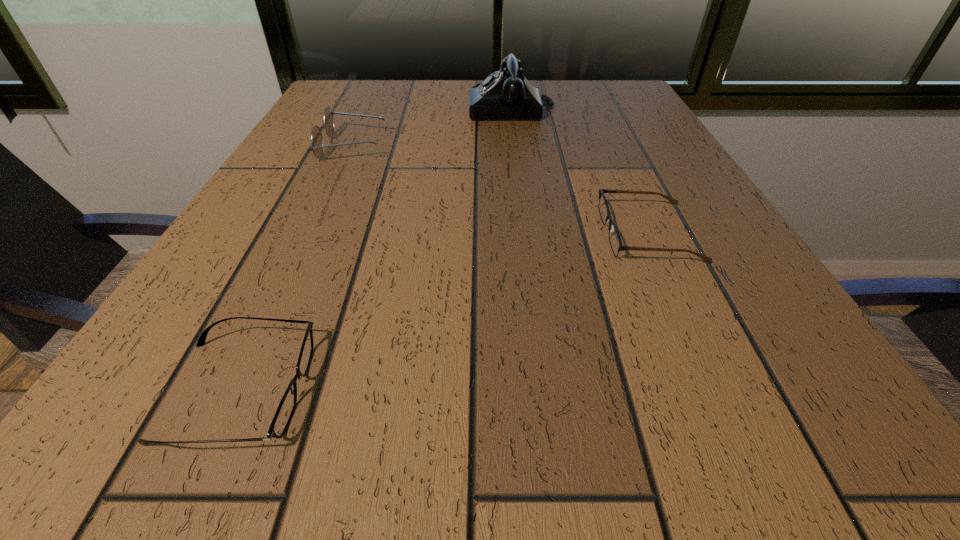
In the image, there is a desktop. In order to click on vacant region at the near edge in this screenshot , I will do [550, 429].

This screenshot has height=540, width=960. Identify the location of free space at the left edge of the desktop. (299, 129).

This screenshot has height=540, width=960. I want to click on vacant space at the right edge of the desktop, so click(654, 126).

Image resolution: width=960 pixels, height=540 pixels. Find the location of `vacant space at the far left corner of the desktop`. vacant space at the far left corner of the desktop is located at coordinates (374, 96).

At what (x,y) coordinates should I click in order to perform the action: click on vacant space at the far right corner. Please return your answer as a coordinate pair (x, y). The height and width of the screenshot is (540, 960). Looking at the image, I should click on (639, 118).

Locate an element on the screen. This screenshot has width=960, height=540. unoccupied area between the nearest spectacles and the farthest spectacles is located at coordinates (296, 268).

This screenshot has height=540, width=960. I want to click on free space that is in between the rightmost object and the second object from right to left, so click(x=580, y=170).

The image size is (960, 540). Identify the location of free space between the farthest spectacles and the second farthest spectacles. (500, 190).

Identify the location of empty space between the tallest spectacles and the telephone. (432, 126).

Locate an element on the screen. free space that is in between the second tallest object and the rightmost spectacles is located at coordinates (500, 190).